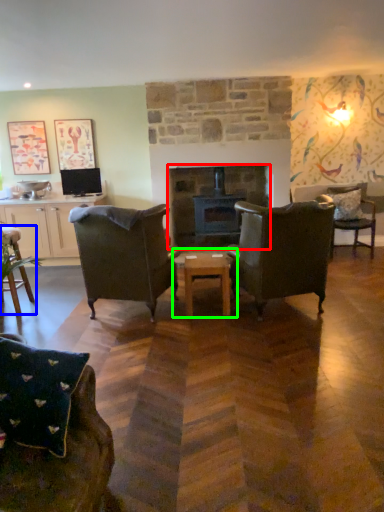
Question: Which object is the closest to the fireplace (highlighted by a red box)? Choose among these: chair (highlighted by a blue box) or coffee table (highlighted by a green box).

Choices:
 (A) chair
 (B) coffee table

Answer: (B)